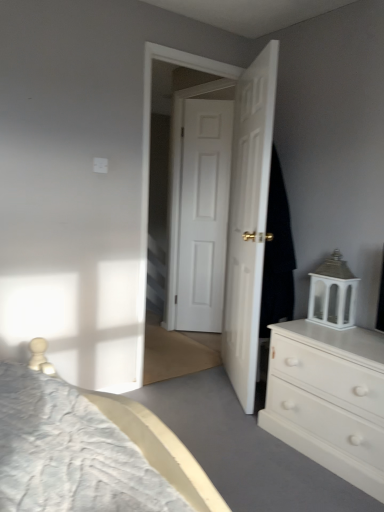
The width and height of the screenshot is (384, 512). Identify the location of free space above white matte chest of drawers at right (from a real-world perspective). (340, 333).